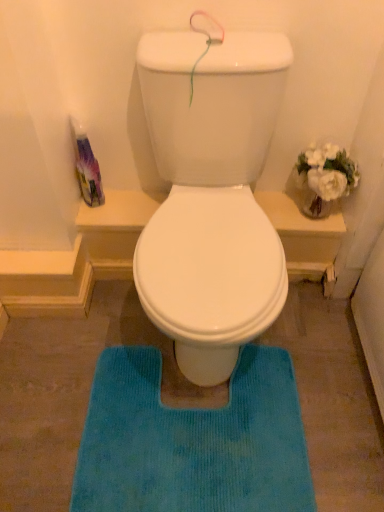
Where is `vacant space to the right of translucent plastic bottle at left`? vacant space to the right of translucent plastic bottle at left is located at coordinates (124, 199).